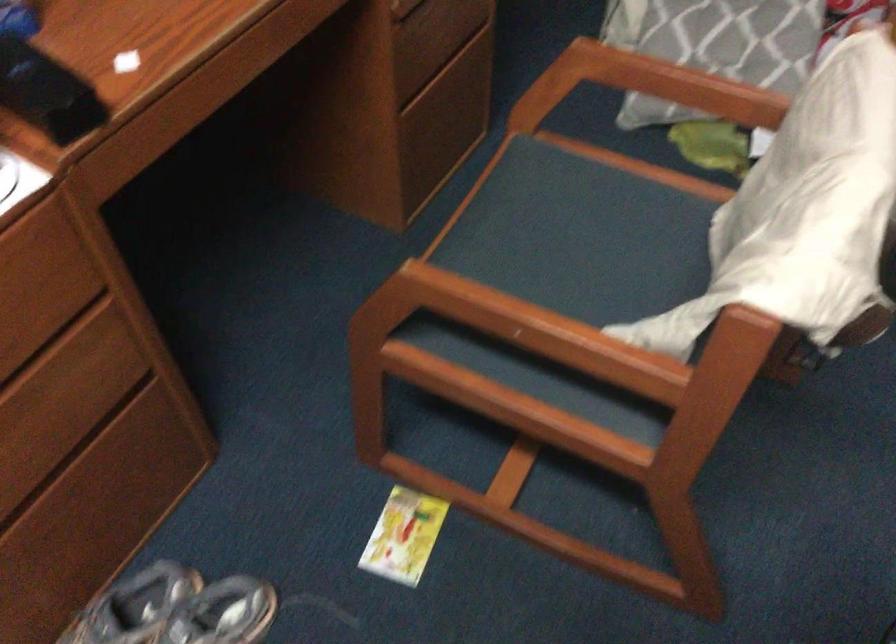
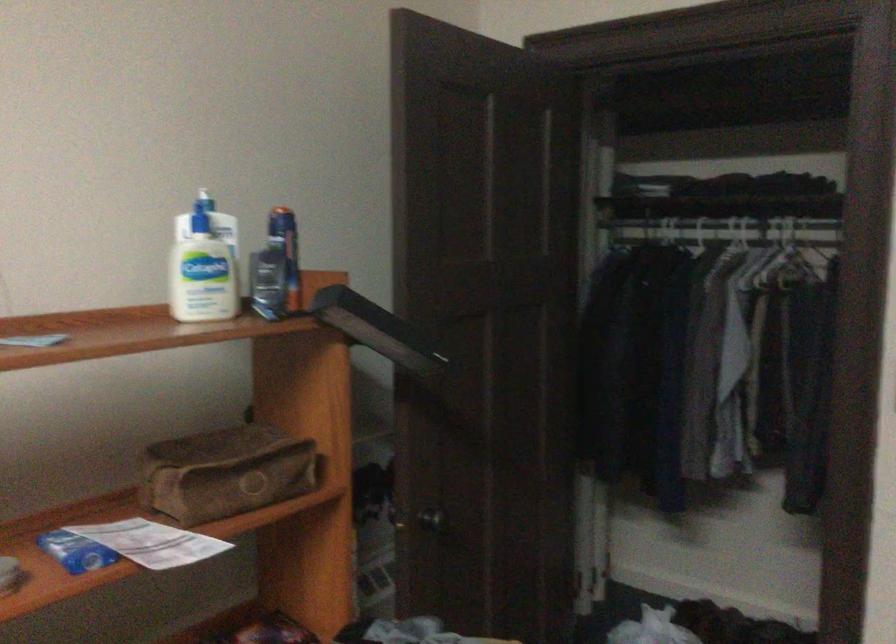
Question: How did the camera likely rotate?

Choices:
 (A) Left
 (B) Right
 (C) Up
 (D) Down

Answer: (C)